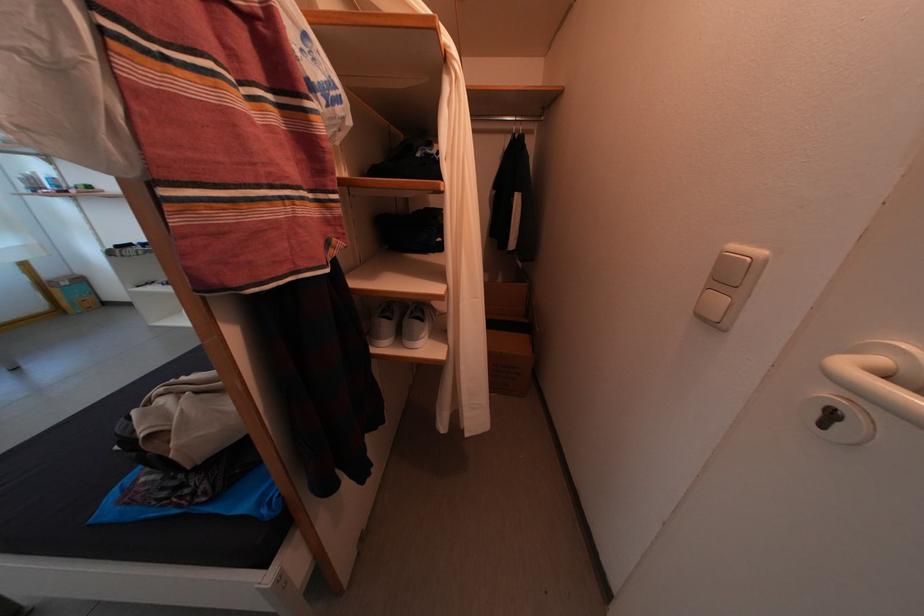
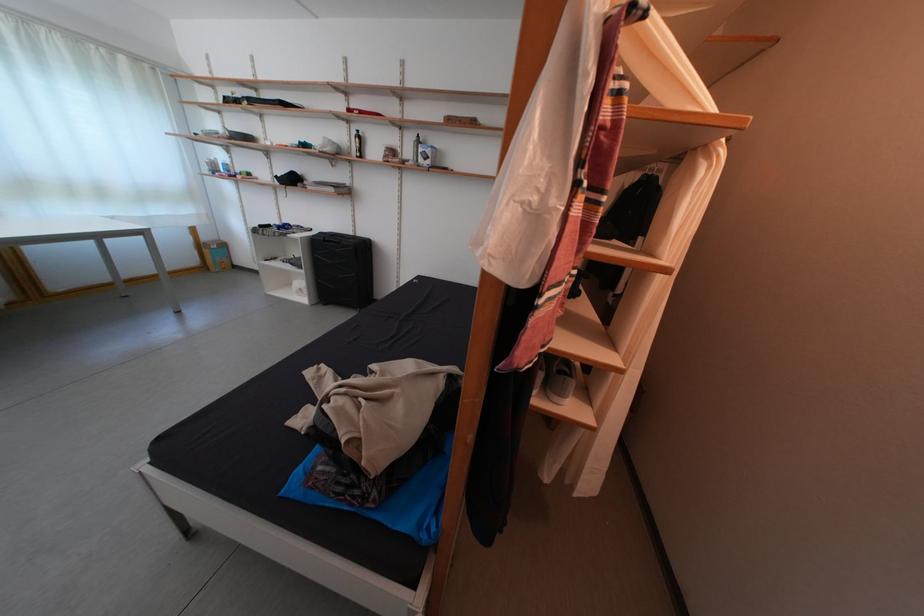
Question: What movement of the cameraman would produce the second image?

Choices:
 (A) Left
 (B) Right
 (C) Forward
 (D) Backward

Answer: (A)